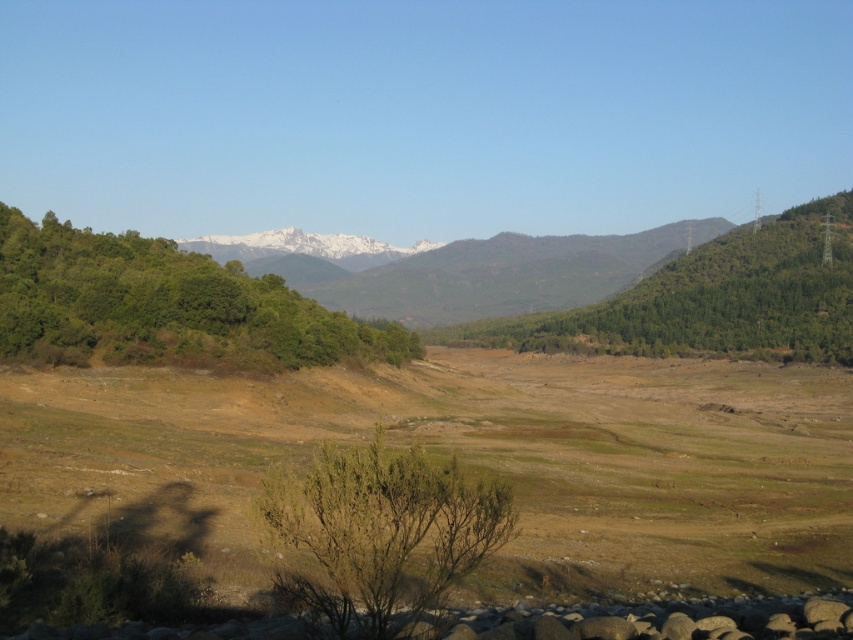
You are standing at the dry, grassy area in the foreground of the landscape. You see two points marked in the scene. Which point, point (329, 474) or point (581, 344), is closer to you?

Point (329, 474) is closer to you because it is in front of point (581, 344).